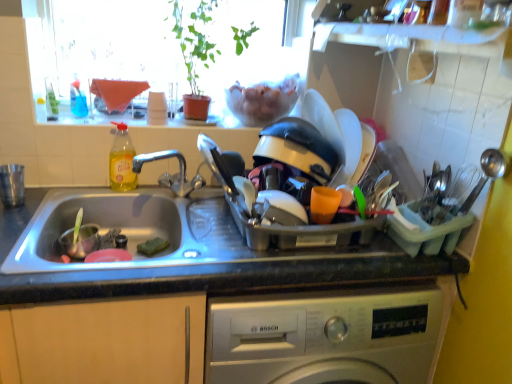
Question: In the image, is transparent glass window at upper center on the left side or the right side of granite gray countertop at center?

Choices:
 (A) right
 (B) left

Answer: (B)

Question: From the image's perspective, is transparent glass window at upper center located above or below granite gray countertop at center?

Choices:
 (A) above
 (B) below

Answer: (A)

Question: Which object is the closest to the metallic silver dish rack at center, acting as the 1th appliance starting from the right?

Choices:
 (A) transparent glass window at upper center
 (B) clear glass window sill at upper center
 (C) yellow translucent bottle at sink left
 (D) brushed metal cup at left, acting as the first appliance starting from the left
 (E) granite gray countertop at center

Answer: (E)

Question: Considering the real-world distances, which object is closest to the transparent glass window at upper center?

Choices:
 (A) brushed metal cup at left, placed as the second appliance when sorted from right to left
 (B) metallic silver dish rack at center, acting as the 1th appliance starting from the right
 (C) clear glass window sill at upper center
 (D) yellow translucent bottle at sink left
 (E) granite gray countertop at center

Answer: (C)